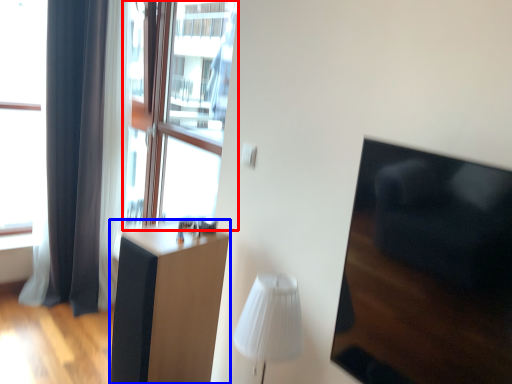
Question: Which object appears farthest to the camera in this image, window screen (highlighted by a red box) or furniture (highlighted by a blue box)?

Choices:
 (A) window screen
 (B) furniture

Answer: (A)